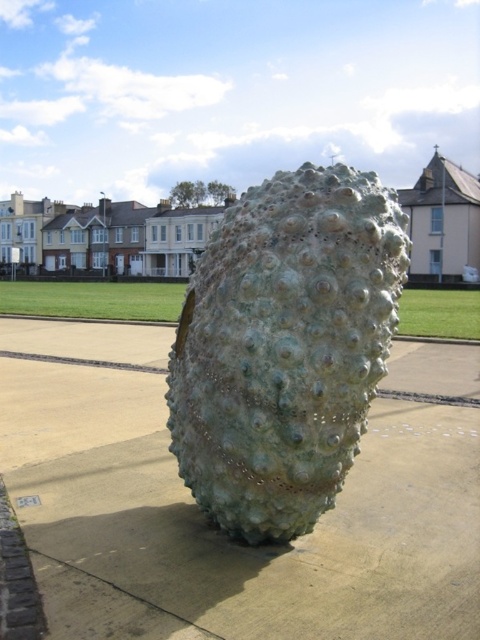
You are standing at the point marked as point (204, 516) in the image. What material are you standing on?

You are standing on greenish concrete at center.

You are a landscape architect designing a garden. You have two elements to place in the center of the garden area. The greenish concrete at center and the green textured sculpture at center. Which one should you choose if you want a larger central feature?

The greenish concrete at center is larger in size than the green textured sculpture at center, so you should choose the greenish concrete at center for a larger central feature.